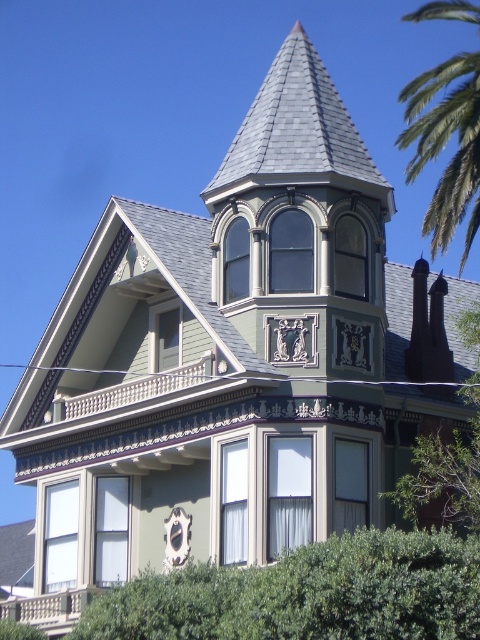
Question: From the image, what is the correct spatial relationship of green leafy palm tree at upper right in relation to stone balustrade at lower left?

Choices:
 (A) below
 (B) above

Answer: (B)

Question: Is green leafy palm tree at upper right to the left of stone balustrade at lower left from the viewer's perspective?

Choices:
 (A) yes
 (B) no

Answer: (B)

Question: Which of the following is the farthest from the observer?

Choices:
 (A) green leafy palm tree at upper right
 (B) stone balustrade at lower left

Answer: (A)

Question: Considering the relative positions of green leafy palm tree at upper right and stone balustrade at lower left in the image provided, where is green leafy palm tree at upper right located with respect to stone balustrade at lower left?

Choices:
 (A) above
 (B) below

Answer: (A)